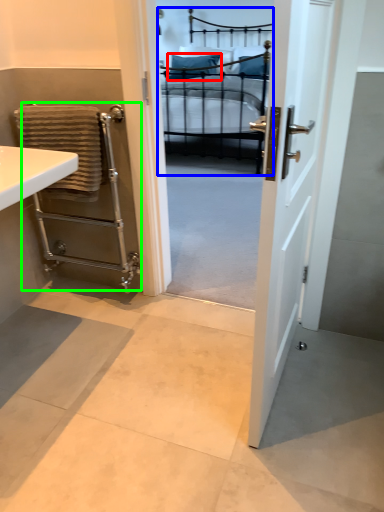
Question: Which is farther away from pillow (highlighted by a red box)? bed (highlighted by a blue box) or balustrade (highlighted by a green box)?

Choices:
 (A) bed
 (B) balustrade

Answer: (B)